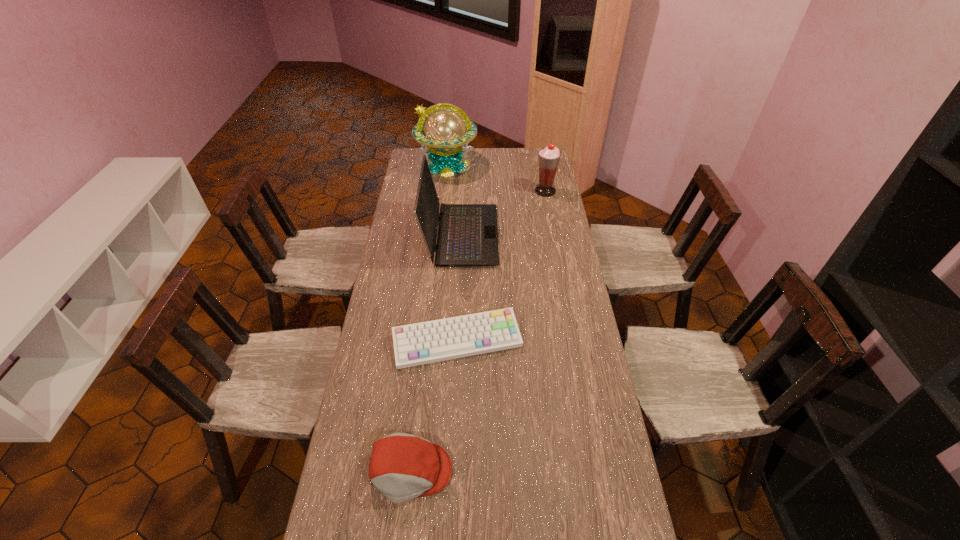
The image size is (960, 540). What are the coordinates of `the farthest object` in the screenshot? It's located at (447, 129).

Identify the location of the tallest object. This screenshot has height=540, width=960. pos(447,129).

Where is `laptop computer`? The width and height of the screenshot is (960, 540). laptop computer is located at coordinates (467, 235).

You are a GUI agent. You are given a task and a screenshot of the screen. Output one action in this format:
    pyautogui.click(x=<x>, y=<y>)
    Task: Click on the second farthest object
    
    Given the screenshot: What is the action you would take?
    pyautogui.click(x=548, y=157)

Locate an element on the screen. smoothie is located at coordinates (548, 157).

Where is `cap`? The image size is (960, 540). cap is located at coordinates (403, 467).

Image resolution: width=960 pixels, height=540 pixels. Identify the location of the fourth tallest object. (403, 467).

This screenshot has width=960, height=540. Find the location of `computer keyboard`. computer keyboard is located at coordinates (427, 342).

This screenshot has height=540, width=960. What are the coordinates of `the shortest object` in the screenshot? It's located at (427, 342).

At what (x,y) coordinates should I click in order to perform the action: click on vacant region located on the right of the farthest object. Please return your answer as a coordinate pair (x, y). The image size is (960, 540). Looking at the image, I should click on (530, 165).